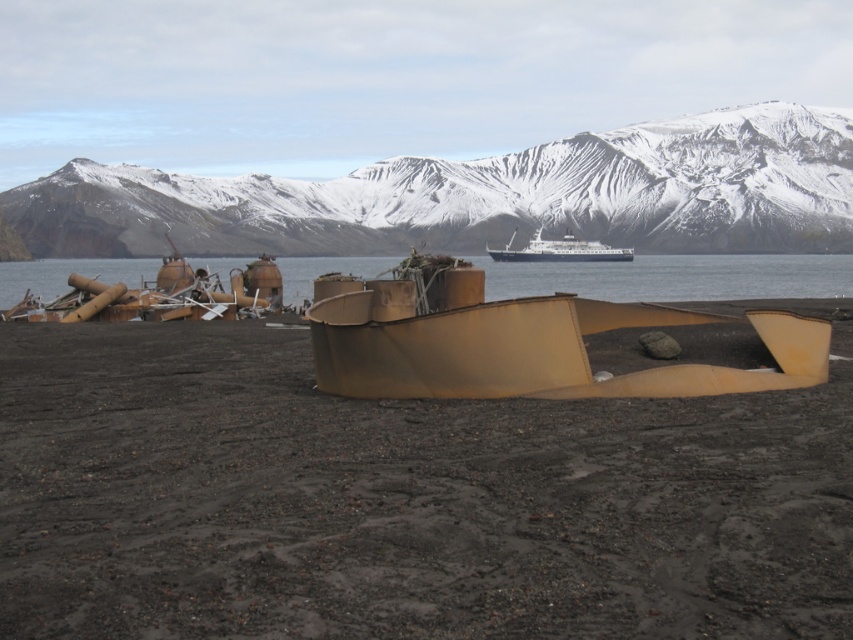
Based on the photo, you are a photographer planning to capture the snowy rock formation at upper center and the brown matte water at center in a single frame. Based on their positions, which object should you focus on first to ensure both are in the frame?

The snowy rock formation at upper center is located above the brown matte water at center, so you should focus on the brown matte water at center first to ensure both are in the frame.

Consider the image. You are a rescue worker trying to reach the rusty metal boat at center from the snowy rock formation at upper center. Given that your equipment can only handle a maximum distance of 150 meters, will you be able to reach the boat?

The distance between the snowy rock formation at upper center and the rusty metal boat at center is 140.69 meters, which is within the equipment limit of 150 meters. Therefore, you can reach the boat.

You are a hiker planning to cross the area between the snowy rock formation at upper center and the rusty metal boat at center. Based on the scene description, which object is located higher in elevation?

The snowy rock formation at upper center is positioned over the rusty metal boat at center, meaning it is higher in elevation.